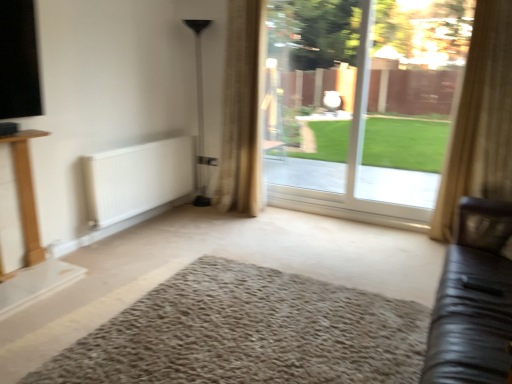
Question: From the image's perspective, is transparent glass door at center on top of black leather couch at right?

Choices:
 (A) yes
 (B) no

Answer: (A)

Question: Is transparent glass door at center to the left of black leather couch at right from the viewer's perspective?

Choices:
 (A) yes
 (B) no

Answer: (A)

Question: Is transparent glass door at center far from black leather couch at right?

Choices:
 (A) no
 (B) yes

Answer: (B)

Question: Is transparent glass door at center positioned in front of black leather couch at right?

Choices:
 (A) yes
 (B) no

Answer: (B)

Question: Can you confirm if transparent glass door at center is wider than black leather couch at right?

Choices:
 (A) yes
 (B) no

Answer: (B)

Question: Can you confirm if transparent glass door at center is smaller than black leather couch at right?

Choices:
 (A) no
 (B) yes

Answer: (B)

Question: Is beige shaggy rug at center outside of white matte radiator at lower left?

Choices:
 (A) yes
 (B) no

Answer: (A)

Question: Are beige shaggy rug at center and white matte radiator at lower left located far from each other?

Choices:
 (A) no
 (B) yes

Answer: (B)

Question: From a real-world perspective, is beige shaggy rug at center physically above white matte radiator at lower left?

Choices:
 (A) no
 (B) yes

Answer: (A)

Question: Does beige shaggy rug at center have a greater height compared to white matte radiator at lower left?

Choices:
 (A) yes
 (B) no

Answer: (B)

Question: Is beige shaggy rug at center shorter than white matte radiator at lower left?

Choices:
 (A) no
 (B) yes

Answer: (B)

Question: Is beige shaggy rug at center wider than white matte radiator at lower left?

Choices:
 (A) yes
 (B) no

Answer: (A)

Question: Can you confirm if black leather couch at right is wider than beige textured curtain at center, arranged as the 1th curtain when viewed from the back?

Choices:
 (A) yes
 (B) no

Answer: (A)